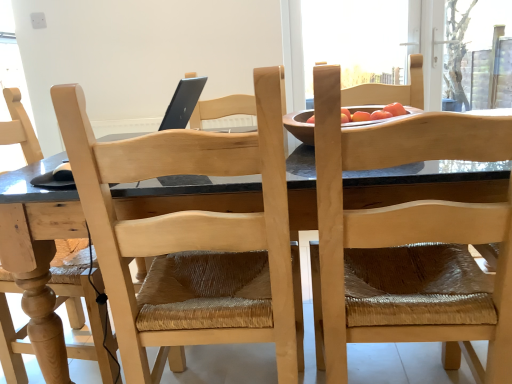
This screenshot has width=512, height=384. What do you see at coordinates (191, 237) in the screenshot?
I see `natural wood chair at center, the first chair when ordered from left to right` at bounding box center [191, 237].

Where is `natural wood chair at center, the first chair when ordered from left to right`? The width and height of the screenshot is (512, 384). natural wood chair at center, the first chair when ordered from left to right is located at coordinates (191, 237).

Where is `natural wood chair at upper right, marked as the first chair in a right-to-left arrangement`? This screenshot has width=512, height=384. natural wood chair at upper right, marked as the first chair in a right-to-left arrangement is located at coordinates [409, 243].

Image resolution: width=512 pixels, height=384 pixels. Describe the element at coordinates (356, 40) in the screenshot. I see `transparent glass window screen at upper center, the 1th window screen in the left-to-right sequence` at that location.

The height and width of the screenshot is (384, 512). In order to click on natural wood chair at center, which appears as the 2th chair when viewed from the right in this screenshot , I will do `click(191, 237)`.

From a real-world perspective, is natural wood chair at center, which appears as the 2th chair when viewed from the right, physically below natural wood chair at upper right, marked as the first chair in a right-to-left arrangement?

Yes, from a real-world perspective, natural wood chair at center, which appears as the 2th chair when viewed from the right, is beneath natural wood chair at upper right, marked as the first chair in a right-to-left arrangement.

From the image's perspective, which one is positioned higher, natural wood chair at center, which appears as the 2th chair when viewed from the right, or natural wood chair at upper right, which is counted as the second chair, starting from the left?

natural wood chair at upper right, which is counted as the second chair, starting from the left, is shown above in the image.

Is point (191, 214) more distant than point (450, 344)?

No, (191, 214) is in front of (450, 344).

How distant is transparent plastic screen at upper right, which is the first window screen in right-to-left order, from natural wood chair at center, the first chair when ordered from left to right?

A distance of 11.12 feet exists between transparent plastic screen at upper right, which is the first window screen in right-to-left order, and natural wood chair at center, the first chair when ordered from left to right.

Is transparent plastic screen at upper right, which is the first window screen in right-to-left order, touching natural wood chair at center, the first chair when ordered from left to right?

transparent plastic screen at upper right, which is the first window screen in right-to-left order, and natural wood chair at center, the first chair when ordered from left to right, are clearly separated.

Identify the location of window screen that is the 2nd object to the right of the natural wood chair at center, which appears as the 2th chair when viewed from the right, starting at the anchor. The height and width of the screenshot is (384, 512). (478, 54).

What's the angular difference between transparent plastic screen at upper right, which is the first window screen in right-to-left order, and natural wood chair at center, the first chair when ordered from left to right,'s facing directions?

The angular difference between transparent plastic screen at upper right, which is the first window screen in right-to-left order, and natural wood chair at center, the first chair when ordered from left to right, is 178 degrees.

Which of these two, transparent glass window screen at upper center, the 1th window screen in the left-to-right sequence, or natural wood chair at center, which appears as the 2th chair when viewed from the right, stands taller?

With more height is natural wood chair at center, which appears as the 2th chair when viewed from the right.

From a real-world perspective, between transparent glass window screen at upper center, the 1th window screen in the left-to-right sequence, and natural wood chair at center, which appears as the 2th chair when viewed from the right, who is vertically higher?

In real-world perspective, transparent glass window screen at upper center, the 1th window screen in the left-to-right sequence, is above.

From a real-world perspective, starting from the natural wood chair at center, which appears as the 2th chair when viewed from the right, which window screen is the 2nd one vertically above it? Please provide its 2D coordinates.

[(356, 40)]

Choose the correct answer: Is transparent plastic screen at upper right, which is counted as the 2th window screen, starting from the left, inside natural wood chair at upper right, marked as the first chair in a right-to-left arrangement, or outside it?

transparent plastic screen at upper right, which is counted as the 2th window screen, starting from the left, lies outside natural wood chair at upper right, marked as the first chair in a right-to-left arrangement.

Does transparent plastic screen at upper right, which is the first window screen in right-to-left order, appear on the left side of natural wood chair at upper right, marked as the first chair in a right-to-left arrangement?

Incorrect, transparent plastic screen at upper right, which is the first window screen in right-to-left order, is not on the left side of natural wood chair at upper right, marked as the first chair in a right-to-left arrangement.

Which is less distant, (461, 2) or (338, 326)?

Clearly, point (461, 2) is more distant from the camera than point (338, 326).

Considering the sizes of objects transparent plastic screen at upper right, which is the first window screen in right-to-left order, and natural wood chair at upper right, which is counted as the second chair, starting from the left, in the image provided, who is wider, transparent plastic screen at upper right, which is the first window screen in right-to-left order, or natural wood chair at upper right, which is counted as the second chair, starting from the left,?

natural wood chair at upper right, which is counted as the second chair, starting from the left.

Considering the points (272, 232) and (348, 2), which point is behind, point (272, 232) or point (348, 2)?

Positioned behind is point (348, 2).

How many degrees apart are the facing directions of natural wood chair at center, the first chair when ordered from left to right, and transparent glass window screen at upper center, positioned as the 2th window screen in right-to-left order?

There is a 178-degree angle between the facing directions of natural wood chair at center, the first chair when ordered from left to right, and transparent glass window screen at upper center, positioned as the 2th window screen in right-to-left order.

Is natural wood chair at center, which appears as the 2th chair when viewed from the right, positioned with its back to transparent glass window screen at upper center, positioned as the 2th window screen in right-to-left order?

natural wood chair at center, which appears as the 2th chair when viewed from the right, is not turned away from transparent glass window screen at upper center, positioned as the 2th window screen in right-to-left order.

Considering the sizes of natural wood chair at center, the first chair when ordered from left to right, and transparent glass window screen at upper center, the 1th window screen in the left-to-right sequence, in the image, is natural wood chair at center, the first chair when ordered from left to right, wider or thinner than transparent glass window screen at upper center, the 1th window screen in the left-to-right sequence,?

Considering their sizes, natural wood chair at center, the first chair when ordered from left to right, looks broader than transparent glass window screen at upper center, the 1th window screen in the left-to-right sequence.

Is natural wood chair at upper right, marked as the first chair in a right-to-left arrangement, with transparent glass window screen at upper center, positioned as the 2th window screen in right-to-left order?

No.

Is natural wood chair at upper right, which is counted as the second chair, starting from the left, bigger or smaller than transparent glass window screen at upper center, the 1th window screen in the left-to-right sequence?

Considering their sizes, natural wood chair at upper right, which is counted as the second chair, starting from the left, takes up more space than transparent glass window screen at upper center, the 1th window screen in the left-to-right sequence.

Considering the positions of objects natural wood chair at upper right, marked as the first chair in a right-to-left arrangement, and transparent glass window screen at upper center, positioned as the 2th window screen in right-to-left order, in the image provided, who is behind, natural wood chair at upper right, marked as the first chair in a right-to-left arrangement, or transparent glass window screen at upper center, positioned as the 2th window screen in right-to-left order,?

transparent glass window screen at upper center, positioned as the 2th window screen in right-to-left order, is further from the camera.

From the image's perspective, which one is positioned lower, natural wood chair at upper right, which is counted as the second chair, starting from the left, or transparent glass window screen at upper center, the 1th window screen in the left-to-right sequence?

natural wood chair at upper right, which is counted as the second chair, starting from the left, from the image's perspective.

Are transparent glass window screen at upper center, the 1th window screen in the left-to-right sequence, and transparent plastic screen at upper right, which is the first window screen in right-to-left order, far apart?

transparent glass window screen at upper center, the 1th window screen in the left-to-right sequence, is far away from transparent plastic screen at upper right, which is the first window screen in right-to-left order.

From a real-world perspective, which object stands above the other?

In real-world perspective, transparent glass window screen at upper center, the 1th window screen in the left-to-right sequence, is above.

Can you tell me how much transparent glass window screen at upper center, positioned as the 2th window screen in right-to-left order, and transparent plastic screen at upper right, which is the first window screen in right-to-left order, differ in facing direction?

There is a 0.00017-degree angle between the facing directions of transparent glass window screen at upper center, positioned as the 2th window screen in right-to-left order, and transparent plastic screen at upper right, which is the first window screen in right-to-left order.

Which is in front, transparent glass window screen at upper center, the 1th window screen in the left-to-right sequence, or transparent plastic screen at upper right, which is counted as the 2th window screen, starting from the left?

Positioned in front is transparent plastic screen at upper right, which is counted as the 2th window screen, starting from the left.

At what (x,y) coordinates should I click in order to perform the action: click on chair lying on the right of natural wood chair at center, which appears as the 2th chair when viewed from the right. Please return your answer as a coordinate pair (x, y). Looking at the image, I should click on (409, 243).

Locate an element on the screen. The image size is (512, 384). the 2nd chair counting from the left side of the transparent plastic screen at upper right, which is counted as the 2th window screen, starting from the left is located at coordinates (191, 237).

Consider the image. Estimate the real-world distances between objects in this image. Which object is closer to natural wood chair at upper right, which is counted as the second chair, starting from the left, natural wood chair at center, the first chair when ordered from left to right, or transparent glass window screen at upper center, positioned as the 2th window screen in right-to-left order?

Based on the image, natural wood chair at center, the first chair when ordered from left to right, appears to be nearer to natural wood chair at upper right, which is counted as the second chair, starting from the left.

Estimate the real-world distances between objects in this image. Which object is closer to transparent plastic screen at upper right, which is counted as the 2th window screen, starting from the left, transparent glass window screen at upper center, positioned as the 2th window screen in right-to-left order, or natural wood chair at center, the first chair when ordered from left to right?

Among the two, transparent glass window screen at upper center, positioned as the 2th window screen in right-to-left order, is located nearer to transparent plastic screen at upper right, which is counted as the 2th window screen, starting from the left.

When comparing their distances from natural wood chair at center, which appears as the 2th chair when viewed from the right, does transparent plastic screen at upper right, which is the first window screen in right-to-left order, or natural wood chair at upper right, which is counted as the second chair, starting from the left, seem closer?

natural wood chair at upper right, which is counted as the second chair, starting from the left, lies closer to natural wood chair at center, which appears as the 2th chair when viewed from the right, than the other object.

In the scene shown: Looking at the image, which one is located closer to natural wood chair at center, the first chair when ordered from left to right, transparent glass window screen at upper center, positioned as the 2th window screen in right-to-left order, or transparent plastic screen at upper right, which is counted as the 2th window screen, starting from the left?

transparent glass window screen at upper center, positioned as the 2th window screen in right-to-left order, lies closer to natural wood chair at center, the first chair when ordered from left to right, than the other object.

From the image, which object appears to be farther from transparent glass window screen at upper center, positioned as the 2th window screen in right-to-left order, transparent plastic screen at upper right, which is the first window screen in right-to-left order, or natural wood chair at upper right, which is counted as the second chair, starting from the left?

Among the two, natural wood chair at upper right, which is counted as the second chair, starting from the left, is located further to transparent glass window screen at upper center, positioned as the 2th window screen in right-to-left order.

Based on their spatial positions, is natural wood chair at center, the first chair when ordered from left to right, or transparent plastic screen at upper right, which is counted as the 2th window screen, starting from the left, further from transparent glass window screen at upper center, the 1th window screen in the left-to-right sequence?

natural wood chair at center, the first chair when ordered from left to right, is further to transparent glass window screen at upper center, the 1th window screen in the left-to-right sequence.

Estimate the real-world distances between objects in this image. Which object is closer to natural wood chair at upper right, which is counted as the second chair, starting from the left, transparent glass window screen at upper center, positioned as the 2th window screen in right-to-left order, or natural wood chair at center, the first chair when ordered from left to right?

natural wood chair at center, the first chair when ordered from left to right.

When comparing their distances from transparent glass window screen at upper center, positioned as the 2th window screen in right-to-left order, does natural wood chair at upper right, which is counted as the second chair, starting from the left, or transparent plastic screen at upper right, which is counted as the 2th window screen, starting from the left, seem closer?

transparent plastic screen at upper right, which is counted as the 2th window screen, starting from the left, lies closer to transparent glass window screen at upper center, positioned as the 2th window screen in right-to-left order, than the other object.

Identify the location of window screen positioned between natural wood chair at center, which appears as the 2th chair when viewed from the right, and transparent glass window screen at upper center, positioned as the 2th window screen in right-to-left order, from near to far. (478, 54).

Image resolution: width=512 pixels, height=384 pixels. I want to click on window screen between natural wood chair at upper right, marked as the first chair in a right-to-left arrangement, and transparent glass window screen at upper center, positioned as the 2th window screen in right-to-left order, from front to back, so pyautogui.click(x=478, y=54).

The width and height of the screenshot is (512, 384). In order to click on chair located between natural wood chair at upper right, marked as the first chair in a right-to-left arrangement, and transparent glass window screen at upper center, positioned as the 2th window screen in right-to-left order, in the depth direction in this screenshot , I will do `click(191, 237)`.

The height and width of the screenshot is (384, 512). I want to click on chair between natural wood chair at upper right, which is counted as the second chair, starting from the left, and transparent plastic screen at upper right, which is counted as the 2th window screen, starting from the left, from front to back, so click(191, 237).